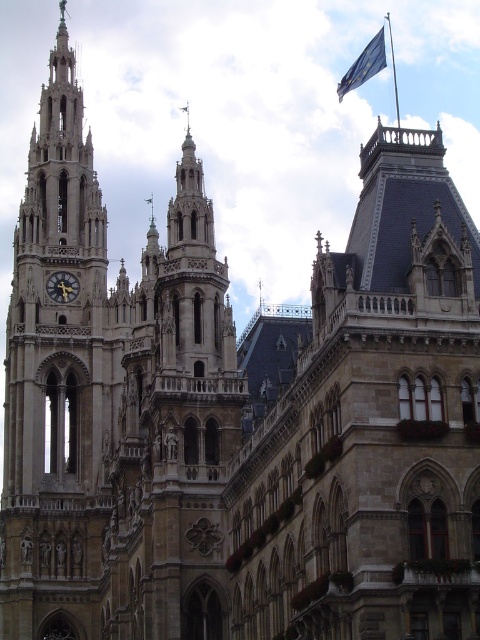
Question: Which point is farther to the camera?

Choices:
 (A) (204, 577)
 (B) (84, 355)

Answer: (B)

Question: Which object appears closest to the camera in this image?

Choices:
 (A) gold metallic clock at center-left
 (B) stone gothic tower at center

Answer: (B)

Question: Can you confirm if stone clock tower at left is positioned above gold metallic clock at center-left?

Choices:
 (A) no
 (B) yes

Answer: (B)

Question: Is stone gothic tower at center closer to camera compared to metallic flag pole at upper center?

Choices:
 (A) yes
 (B) no

Answer: (A)

Question: Can you confirm if stone clock tower at left is positioned below gold metallic clock at center-left?

Choices:
 (A) yes
 (B) no

Answer: (B)

Question: Which object is the farthest from the stone gothic tower at center?

Choices:
 (A) blue fabric flag at upper right
 (B) gold metallic clock at center-left
 (C) metallic flag pole at upper center
 (D) stone clock tower at left

Answer: (C)